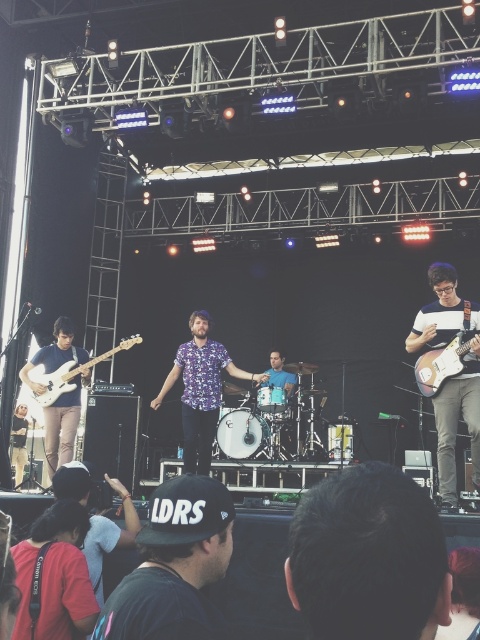
You are a photographer at the live music performance. You want to take a photo of the lead vocalist whose dark brown hair is at point (368, 557). Where should you position your camera to capture the vocalist clearly?

The dark brown hair at center is located at point (368, 557), so the camera should be positioned directly facing the center of the stage where the lead vocalist is standing to capture the vocalist clearly.

You are a photographer at the concert venue. You want to capture a photo of the dark brown hair at center and dark blue shirt at lower left. Based on their heights, which subject should you focus on first to ensure proper framing?

The dark brown hair at center is shorter than the dark blue shirt at lower left. Therefore, you should focus on the dark blue shirt at lower left first since it is taller and will require more adjustment for proper framing.